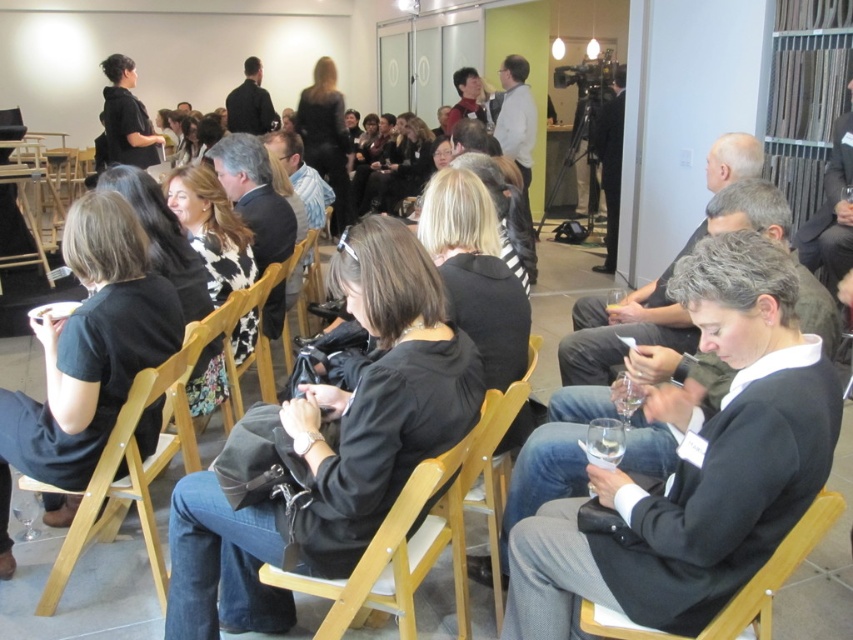
Based on the photo, you are standing at the entrance of the room and want to find the black matte blazer at center. Which direction should you move to locate it?

The black matte blazer at center is located at coordinates 0.727 on the x axis and 0.817 on the y axis. To reach it from the entrance, move towards the center of the room slightly to the right and forward.

You are standing in the room and want to move from the point at coordinates point (793, 412) to the point at coordinates point (97, 490). Which direction should you move to get closer to your destination?

Since point (793, 412) is closer to the viewer than point (97, 490), you should move away from the viewer to reach the destination point (97, 490).